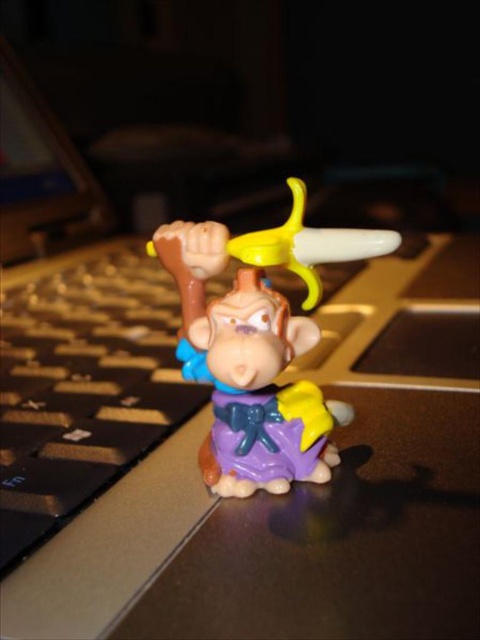
Can you confirm if black plastic keyboard at left is smaller than matte plastic monkey at center?

No.

Which is behind, point (132, 419) or point (210, 452)?

The point (132, 419) is more distant.

What are the coordinates of `black plastic keyboard at left` in the screenshot? It's located at (83, 385).